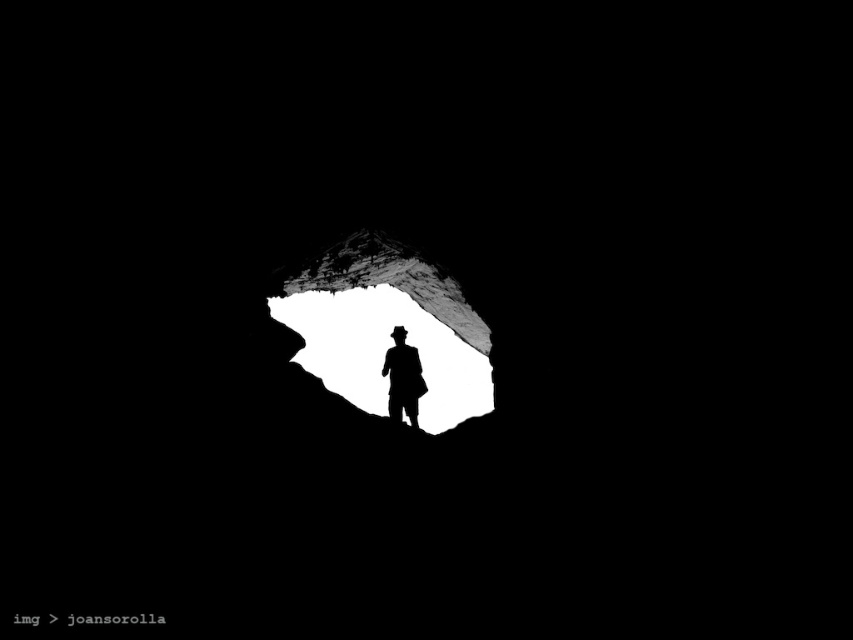
Question: Is white matte cave at center positioned in front of black matte silhouette at center?

Choices:
 (A) no
 (B) yes

Answer: (B)

Question: Can you confirm if white matte cave at center is thinner than black matte silhouette at center?

Choices:
 (A) no
 (B) yes

Answer: (A)

Question: Which of the following is the farthest from the observer?

Choices:
 (A) (383, 344)
 (B) (399, 362)

Answer: (A)

Question: Which of the following is the farthest from the observer?

Choices:
 (A) (408, 346)
 (B) (431, 422)

Answer: (B)

Question: Does white matte cave at center appear under black matte silhouette at center?

Choices:
 (A) yes
 (B) no

Answer: (A)